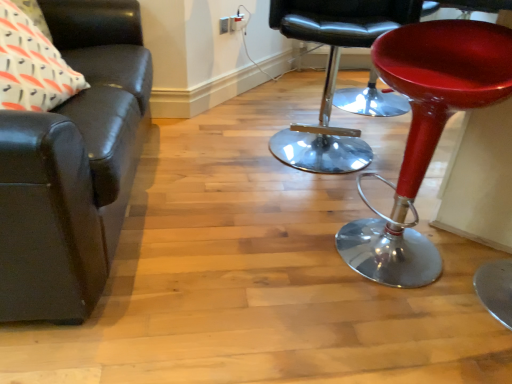
Question: In the image, is matte black leather couch at left, which is the second chair from right to left, positioned in front of or behind shiny chrome stool at center, placed as the 2th chair when sorted from left to right?

Choices:
 (A) behind
 (B) front

Answer: (B)

Question: From the image's perspective, relative to shiny chrome stool at center, placed as the 2th chair when sorted from left to right, is matte black leather couch at left, which is counted as the 1th chair, starting from the left, above or below?

Choices:
 (A) below
 (B) above

Answer: (A)

Question: Estimate the real-world distances between objects in this image. Which object is farther from the shiny chrome stool at center, placed as the 2th chair when sorted from left to right?

Choices:
 (A) matte black leather couch at left, which is the second chair from right to left
 (B) shiny red stool at right
 (C) white printed fabric pillow at upper left

Answer: (C)

Question: Which of these objects is positioned closest to the shiny red stool at right?

Choices:
 (A) shiny chrome stool at center, marked as the 1th chair in a right-to-left arrangement
 (B) white printed fabric pillow at upper left
 (C) matte black leather couch at left, which is counted as the 1th chair, starting from the left

Answer: (A)